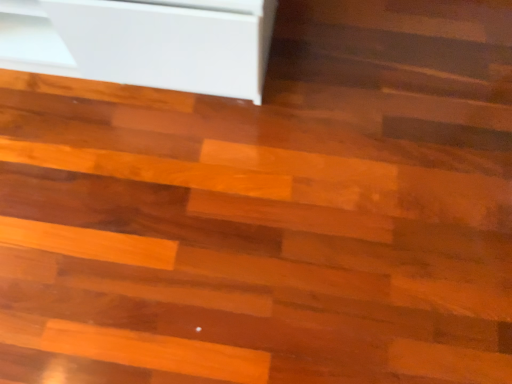
You are a GUI agent. You are given a task and a screenshot of the screen. Output one action in this format:
    pyautogui.click(x=<x>, y=<y>)
    Task: Click on the vacant area that is situated to the right of white glossy baseboard at upper left
    
    Given the screenshot: What is the action you would take?
    pyautogui.click(x=343, y=99)